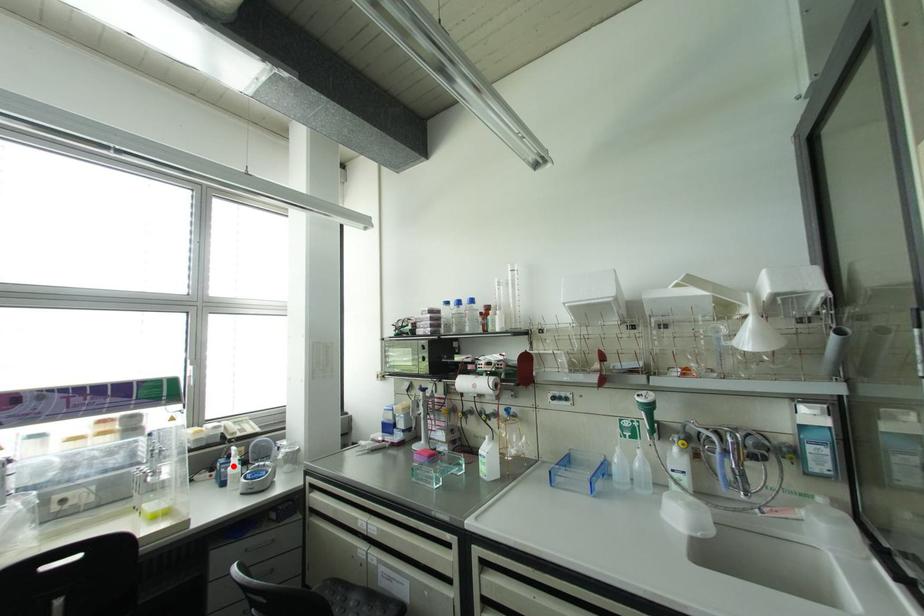
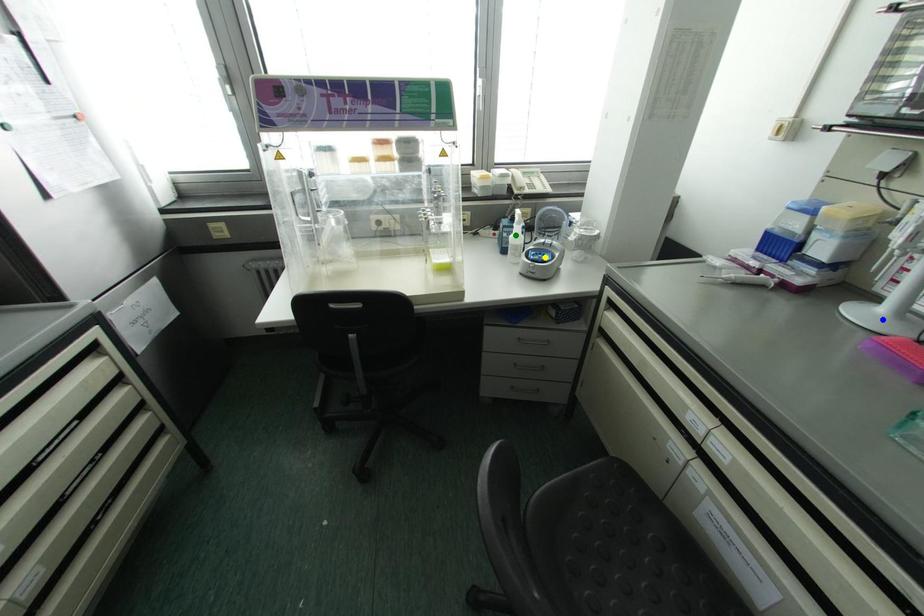
Question: I am providing you with two images of the same scene from different viewpoints. A red point is marked on the first image. You are given multiple points on the second image. Which point in image 2 is actually the same real-world point as the red point in image 1?

Choices:
 (A) green point
 (B) blue point
 (C) yellow point

Answer: (A)